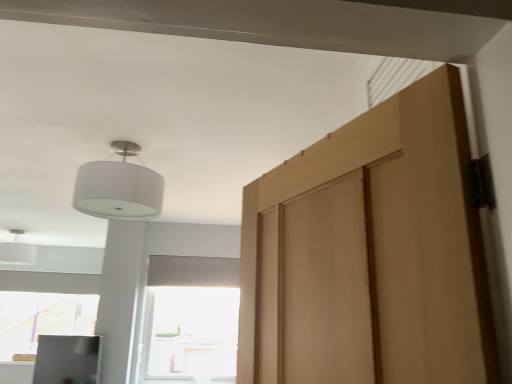
Question: Is transparent glass window at center taller or shorter than white fabric lampshade at upper left?

Choices:
 (A) tall
 (B) short

Answer: (A)

Question: From the image's perspective, is transparent glass window at center located above or below white fabric lampshade at upper left?

Choices:
 (A) below
 (B) above

Answer: (A)

Question: Estimate the real-world distances between objects in this image. Which object is farther from the white fabric lampshade at upper left?

Choices:
 (A) transparent glass window at center
 (B) white matte lampshade at upper left

Answer: (B)

Question: Which of these objects is positioned farthest from the white matte lampshade at upper left?

Choices:
 (A) white fabric lampshade at upper left
 (B) transparent glass window at center

Answer: (A)